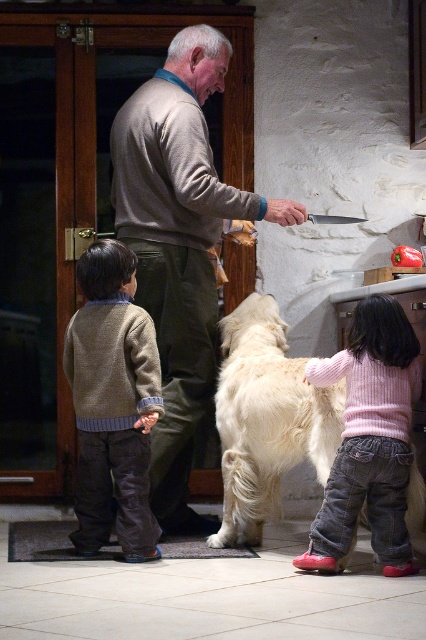
Can you confirm if light brown sweater at center is smaller than knit sweater at left?

Actually, light brown sweater at center might be larger than knit sweater at left.

From the picture: Does light brown sweater at center have a lesser height compared to knit sweater at left?

No.

Who is more distant from viewer, (112,193) or (146,433)?

Point (112,193)

I want to click on light brown sweater at center, so click(x=178, y=244).

Which is more to the left, light brown sweater at center or white fluffy dog at center?

Positioned to the left is light brown sweater at center.

Does light brown sweater at center have a greater height compared to white fluffy dog at center?

→ Yes.

Is point (187, 470) more distant than point (264, 326)?

Yes, it is.

Where is `light brown sweater at center`? Image resolution: width=426 pixels, height=640 pixels. light brown sweater at center is located at coordinates (178, 244).

Who is higher up, knit sweater at left or white fluffy dog at center?

knit sweater at left

Does knit sweater at left have a larger size compared to white fluffy dog at center?

No, knit sweater at left is not bigger than white fluffy dog at center.

What do you see at coordinates (112, 403) in the screenshot?
I see `knit sweater at left` at bounding box center [112, 403].

This screenshot has width=426, height=640. What are the coordinates of `knit sweater at left` in the screenshot? It's located at (112, 403).